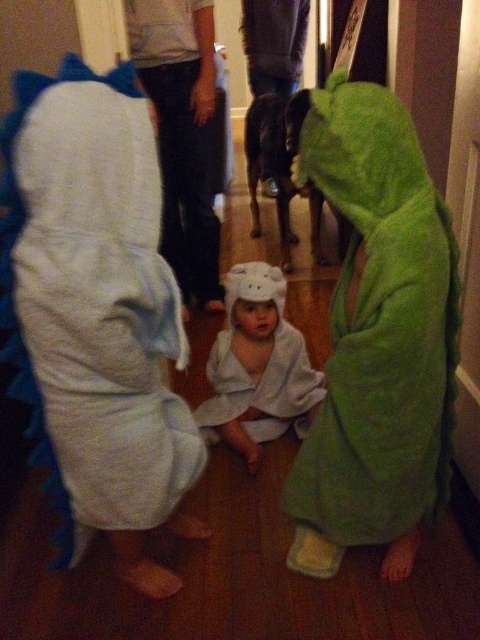
Is point (130, 291) behind point (339, 131)?

No, it is not.

Is white fluffy dress at left thinner than green fuzzy bathrobe at right?

Yes.

Measure the distance between point (120,173) and camera.

1.16 meters

Where is `white fluffy dress at left`? white fluffy dress at left is located at coordinates (101, 305).

Between point (324, 524) and point (244, 396), which one is positioned behind?

Point (244, 396)

Does green fuzzy bathrobe at right have a greater width compared to white towel at center?

No.

Find the location of `green fuzzy bathrobe at right`. green fuzzy bathrobe at right is located at coordinates (380, 326).

Find the location of a particular element. green fuzzy bathrobe at right is located at coordinates (380, 326).

Which of these two, white fluffy dress at left or white towel at center, stands shorter?

white towel at center is shorter.

Locate an element on the screen. The width and height of the screenshot is (480, 640). white fluffy dress at left is located at coordinates (101, 305).

Identify the location of white fluffy dress at left. (101, 305).